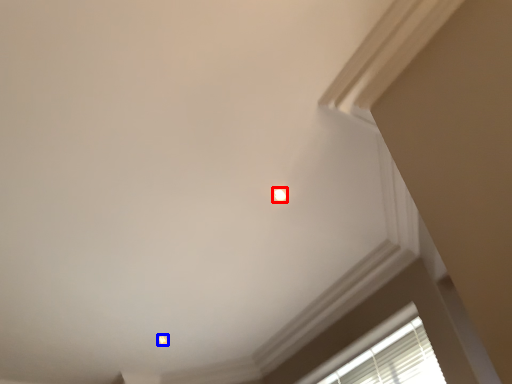
Question: Which of the following is the closest to the observer, dot (highlighted by a red box) or dot (highlighted by a blue box)?

Choices:
 (A) dot
 (B) dot

Answer: (A)